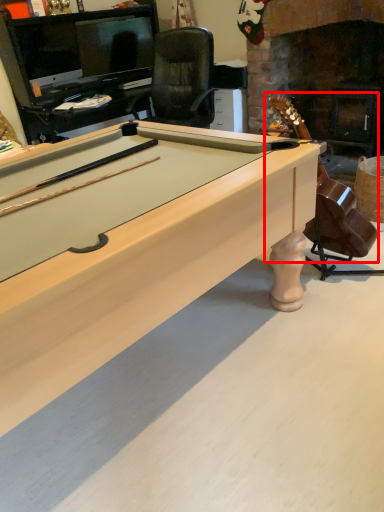
Question: From the image's perspective, what is the correct spatial relationship of guitar (annotated by the red box) in relation to billiard table?

Choices:
 (A) above
 (B) below

Answer: (A)